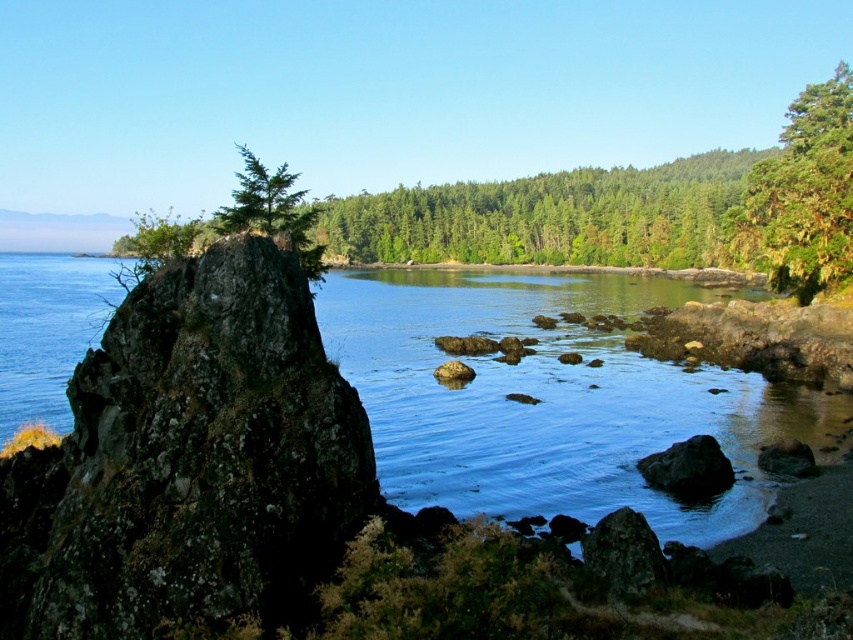
Where is `lichen-covered rock at left`? Image resolution: width=853 pixels, height=640 pixels. lichen-covered rock at left is located at coordinates (187, 458).

Is lichen-covered rock at left wider than dark gray rock at lower right?

Incorrect, lichen-covered rock at left's width does not surpass dark gray rock at lower right's.

Between point (292, 312) and point (708, 477), which one is positioned in front?

Point (292, 312) is more forward.

Find the location of `lichen-covered rock at left`. lichen-covered rock at left is located at coordinates (187, 458).

Is lichen-covered rock at left to the right of green lichen-covered rock at center-left from the viewer's perspective?

Yes, lichen-covered rock at left is to the right of green lichen-covered rock at center-left.

Is lichen-covered rock at left behind green lichen-covered rock at center-left?

No, lichen-covered rock at left is in front of green lichen-covered rock at center-left.

Who is more distant from viewer, (x=355, y=500) or (x=299, y=230)?

Positioned behind is point (x=299, y=230).

Identify the location of lichen-covered rock at left. The height and width of the screenshot is (640, 853). (187, 458).

Does green rough bark tree at upper right appear under green lichen-covered rock at center-left?

Incorrect, green rough bark tree at upper right is not positioned below green lichen-covered rock at center-left.

Is point (840, 104) more distant than point (251, 186)?

Yes, point (840, 104) is farther from viewer.

The height and width of the screenshot is (640, 853). In order to click on green rough bark tree at upper right in this screenshot , I will do `click(802, 195)`.

You are a GUI agent. You are given a task and a screenshot of the screen. Output one action in this format:
    pyautogui.click(x=<x>, y=<y>)
    Task: Click on the green rough bark tree at upper right
    Image resolution: width=853 pixels, height=640 pixels.
    Given the screenshot: What is the action you would take?
    pyautogui.click(x=802, y=195)